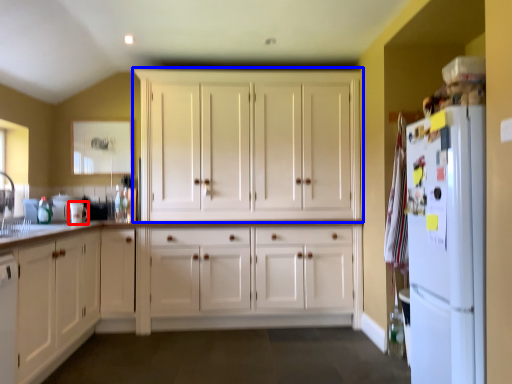
Question: Which object is further to the camera taking this photo, appliance (highlighted by a red box) or cabinetry (highlighted by a blue box)?

Choices:
 (A) appliance
 (B) cabinetry

Answer: (B)